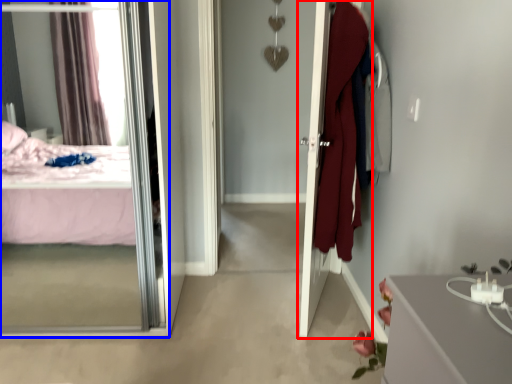
Question: Which of the following is the farthest to the observer, door (highlighted by a red box) or mirror (highlighted by a blue box)?

Choices:
 (A) door
 (B) mirror

Answer: (A)